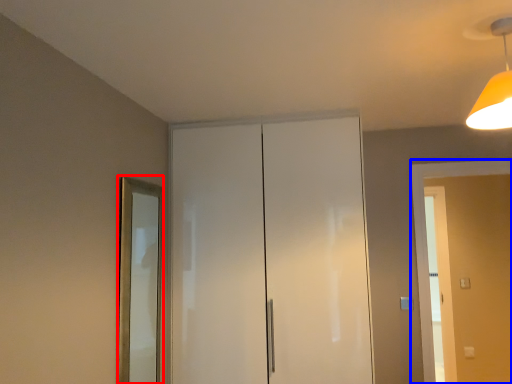
Question: Among these objects, which one is farthest to the camera, mirror (highlighted by a red box) or screen door (highlighted by a blue box)?

Choices:
 (A) mirror
 (B) screen door

Answer: (B)